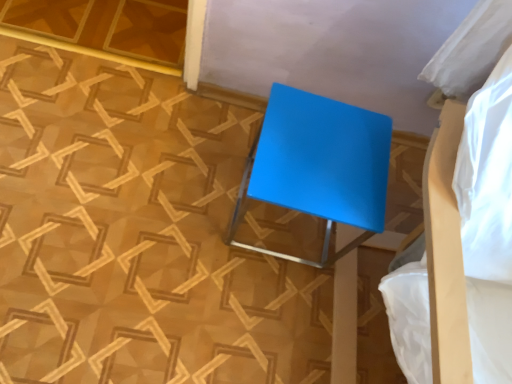
Question: From a real-world perspective, is matte blue bed at upper right above or below blue glossy stool at center?

Choices:
 (A) below
 (B) above

Answer: (B)

Question: From the image's perspective, is matte blue bed at upper right above or below blue glossy stool at center?

Choices:
 (A) below
 (B) above

Answer: (A)

Question: Considering the positions of matte blue bed at upper right and blue glossy stool at center in the image, is matte blue bed at upper right taller or shorter than blue glossy stool at center?

Choices:
 (A) short
 (B) tall

Answer: (B)

Question: Looking at the image, does blue glossy stool at center seem bigger or smaller compared to matte blue bed at upper right?

Choices:
 (A) big
 (B) small

Answer: (B)

Question: Is point tap(305, 124) closer or farther from the camera than point tap(463, 137)?

Choices:
 (A) closer
 (B) farther

Answer: (B)

Question: In terms of width, does blue glossy stool at center look wider or thinner when compared to matte blue bed at upper right?

Choices:
 (A) thin
 (B) wide

Answer: (A)

Question: Considering the relative positions of blue glossy stool at center and matte blue bed at upper right in the image provided, is blue glossy stool at center to the left or to the right of matte blue bed at upper right?

Choices:
 (A) left
 (B) right

Answer: (A)